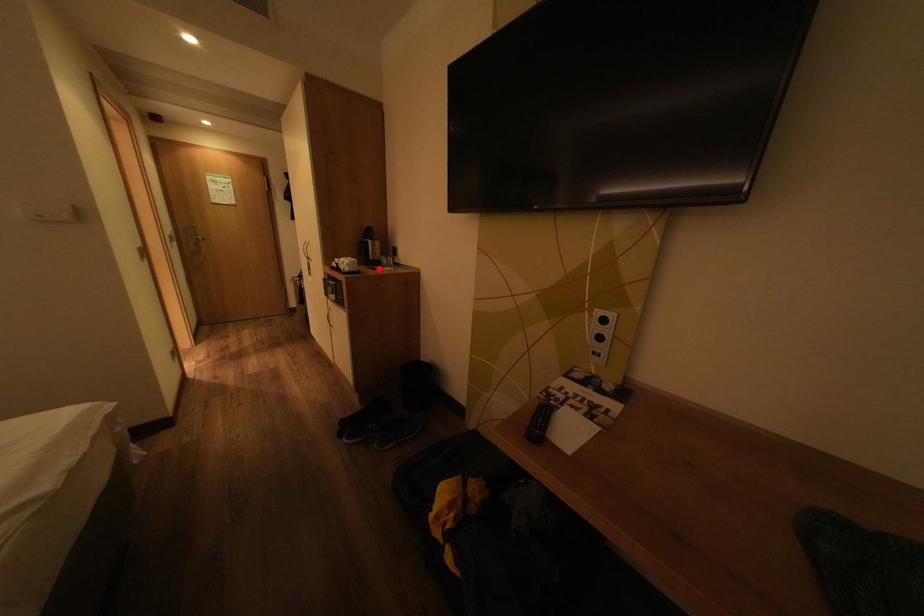
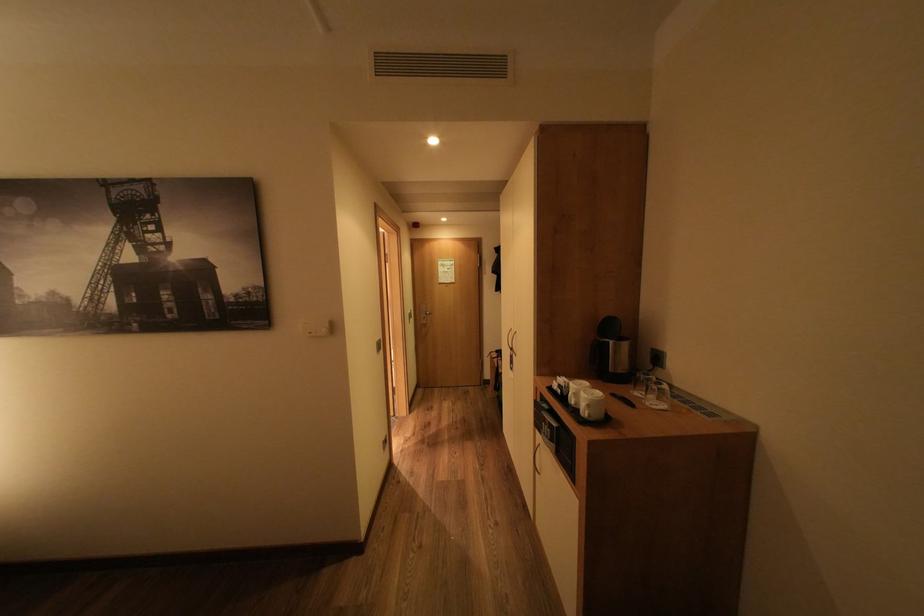
Find the pixel in the second image that matches the highlighted location in the first image.

(624, 395)